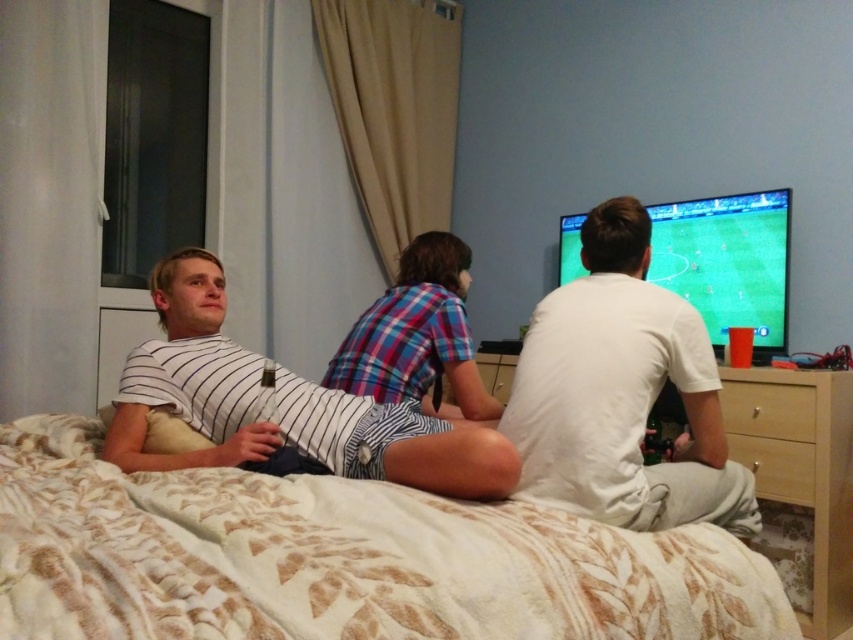
You are organizing a laundry day and need to sort clothes by size. You have a white matte shirt at center and a white striped shirt at left. Which shirt should you place in the large size bin?

The white striped shirt at left should go into the large size bin because it is thicker than the white matte shirt at center.